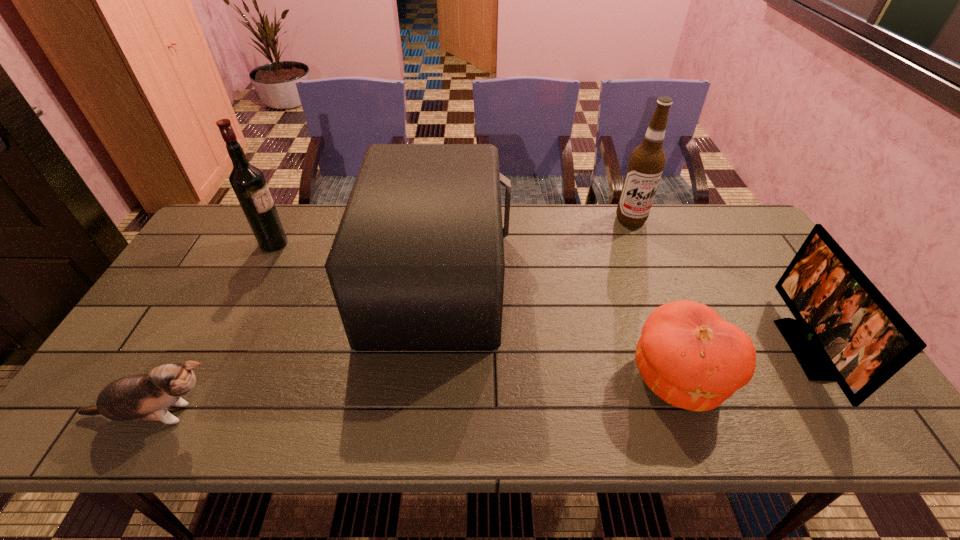
Where is `vacant space located 0.260m on the front-facing side of the monitor`? vacant space located 0.260m on the front-facing side of the monitor is located at coordinates (686, 349).

Image resolution: width=960 pixels, height=540 pixels. I want to click on vacant space located 0.270m on the front-facing side of the monitor, so (x=683, y=349).

You are a GUI agent. You are given a task and a screenshot of the screen. Output one action in this format:
    pyautogui.click(x=<x>, y=<y>)
    Task: Click on the vacant space situated on the right of the pumpkin
    
    Given the screenshot: What is the action you would take?
    pyautogui.click(x=852, y=379)

Locate an element on the screen. blank area located at the face of the cat is located at coordinates (270, 415).

The image size is (960, 540). What are the coordinates of `alcohol positioned at the far edge` in the screenshot? It's located at (647, 161).

Image resolution: width=960 pixels, height=540 pixels. Find the location of `wine bottle that is positioned at the far edge`. wine bottle that is positioned at the far edge is located at coordinates (248, 182).

The height and width of the screenshot is (540, 960). What are the coordinates of `microwave oven at the far edge` in the screenshot? It's located at (417, 264).

Identify the location of monitor present at the near edge. The width and height of the screenshot is (960, 540). (845, 330).

The width and height of the screenshot is (960, 540). What are the coordinates of `pumpkin situated at the near edge` in the screenshot? It's located at (690, 357).

At what (x,y) coordinates should I click in order to perform the action: click on cat that is at the near edge. Please return your answer as a coordinate pair (x, y). The image size is (960, 540). Looking at the image, I should click on (146, 397).